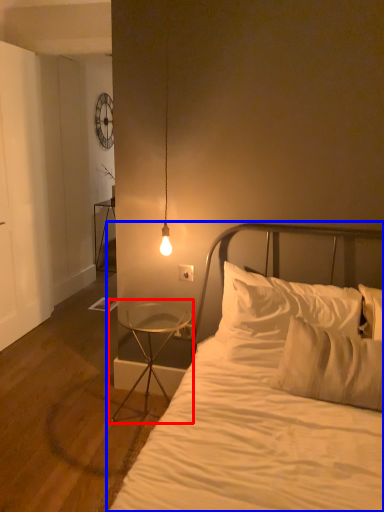
Question: Which object is further to the camera taking this photo, nightstand (highlighted by a red box) or bed (highlighted by a blue box)?

Choices:
 (A) nightstand
 (B) bed

Answer: (A)